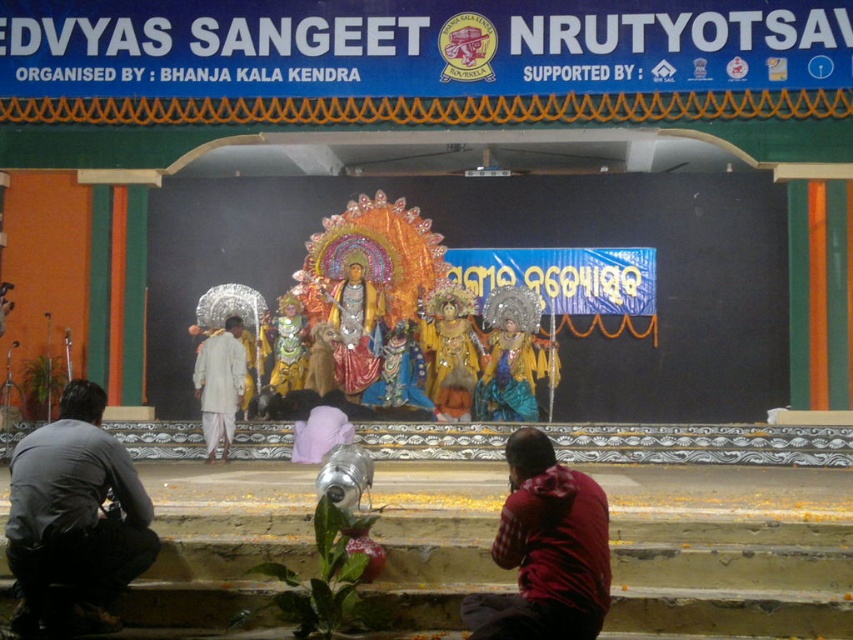
You are a stagehand preparing for the NRUTYOTSAV event. You need to place a large decorative item that requires a larger space. Which object between the dark gray fabric at lower left and the red plaid shirt at lower right should you choose to place it on?

The dark gray fabric at lower left is bigger than the red plaid shirt at lower right, so you should choose the dark gray fabric at lower left to place the large decorative item.